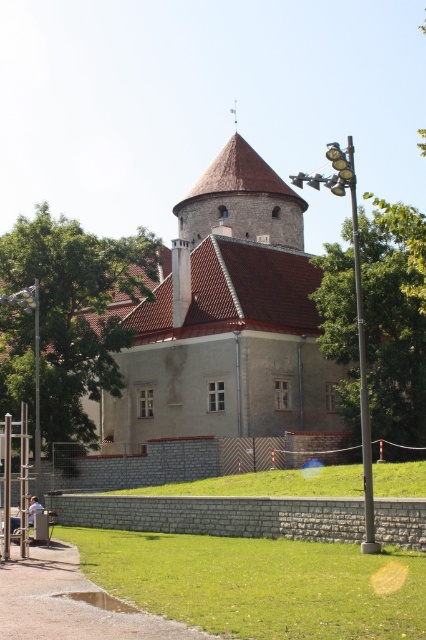
You are a gardener standing on the green grass at lower center and need to water the gray stone castle at center. Since the water hose can only reach 20 meters, will you be able to water it without moving closer?

The gray stone castle at center is 22.87 meters away from the green grass at lower center. Since the hose can only reach 20 meters, you cannot water it without moving closer.

You are a gardener standing on the green grass at lower center, looking up at the gray stone castle at center. Which direction should you face to see the base of the castle?

You should face upward because the gray stone castle at center is located above green grass at lower center, so the base of the castle would be visible in that direction.